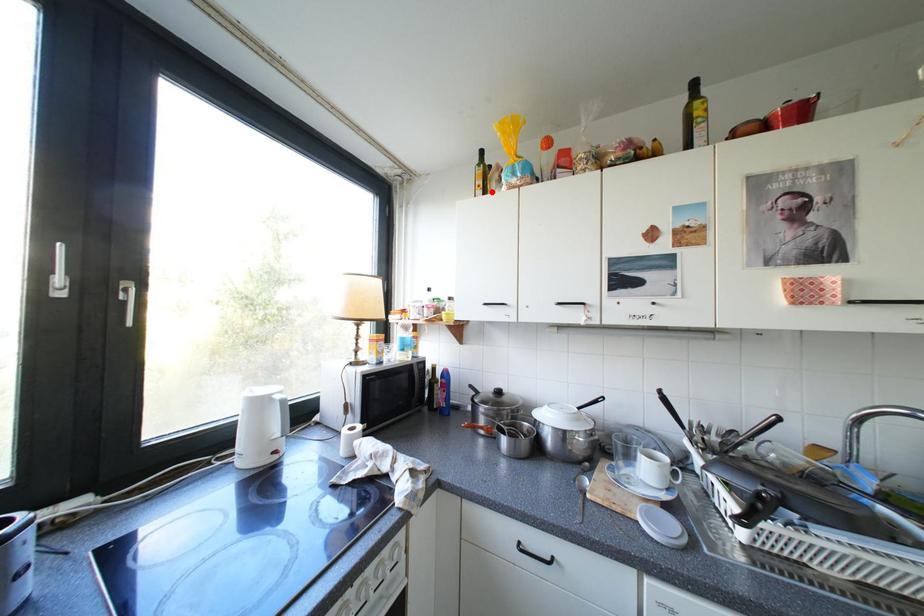
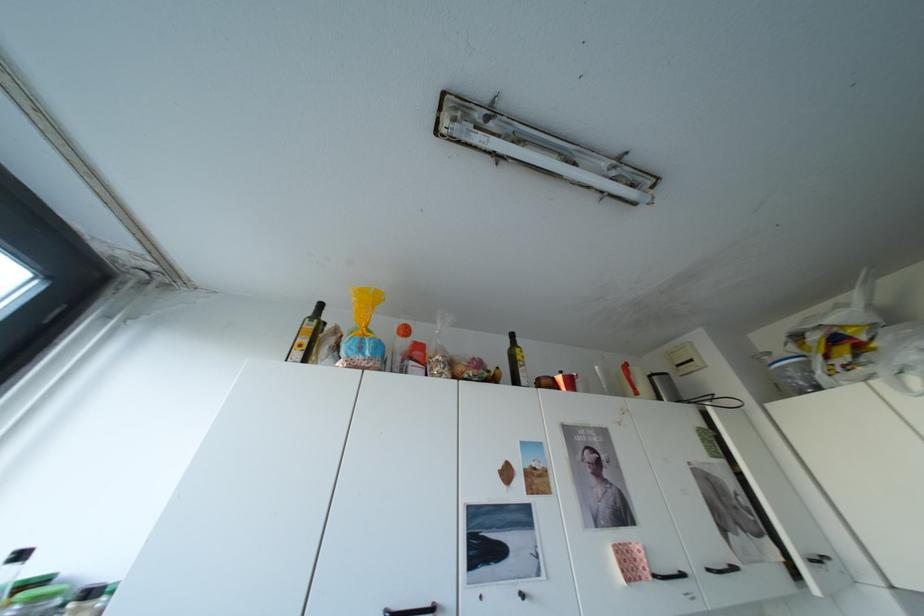
In the second image, find the point that corresponds to the highlighted location in the first image.

(310, 353)